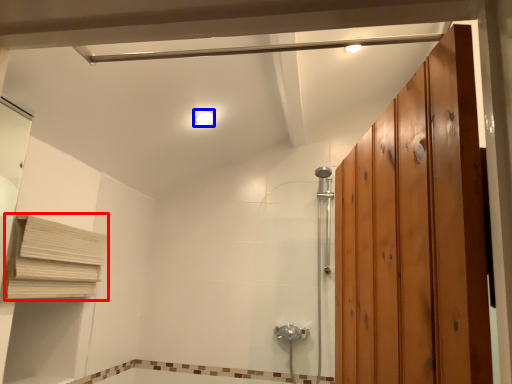
Question: Among these objects, which one is nearest to the camera, shelf (highlighted by a red box) or light fixture (highlighted by a blue box)?

Choices:
 (A) shelf
 (B) light fixture

Answer: (A)